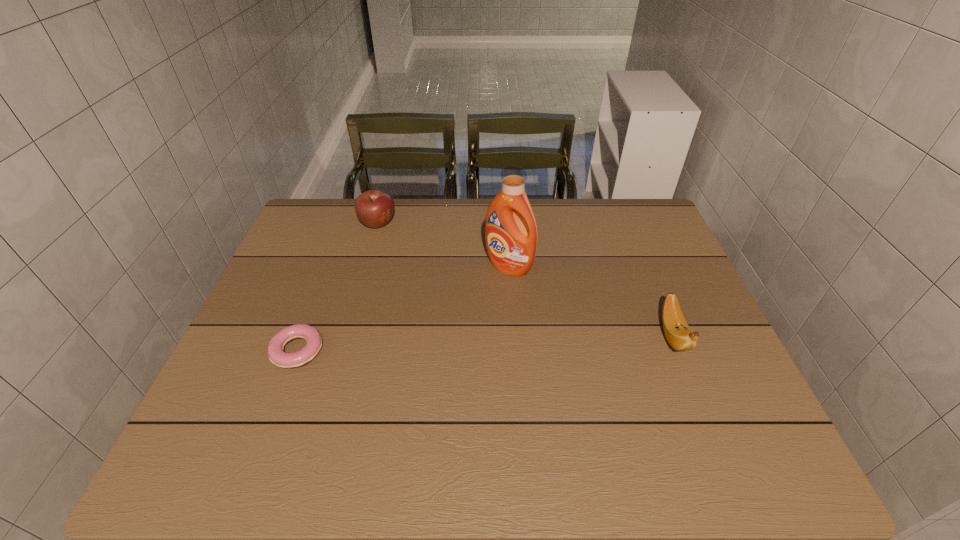
The image size is (960, 540). Identify the location of free space between the detergent and the rightmost object. (590, 301).

Where is `unoccupied position between the banana and the second farthest object`? The image size is (960, 540). unoccupied position between the banana and the second farthest object is located at coordinates (590, 301).

You are a GUI agent. You are given a task and a screenshot of the screen. Output one action in this format:
    pyautogui.click(x=<x>, y=<y>)
    Task: Click on the vacant space in between the detergent and the shortest object
    The width and height of the screenshot is (960, 540).
    Given the screenshot: What is the action you would take?
    pyautogui.click(x=403, y=309)

Image resolution: width=960 pixels, height=540 pixels. I want to click on object that stands as the third closest to the second object from right to left, so click(277, 356).

The height and width of the screenshot is (540, 960). Find the location of `the second closest object relative to the farthest object`. the second closest object relative to the farthest object is located at coordinates (277, 356).

The width and height of the screenshot is (960, 540). In order to click on vacant area in the image that satisfies the following two spatial constraints: 1. on the front side of the farthest object; 2. on the right side of the banana in this screenshot , I will do `click(346, 335)`.

Where is `free space that satisfies the following two spatial constraints: 1. on the back side of the banana; 2. on the right side of the shortest object`? This screenshot has height=540, width=960. free space that satisfies the following two spatial constraints: 1. on the back side of the banana; 2. on the right side of the shortest object is located at coordinates (303, 335).